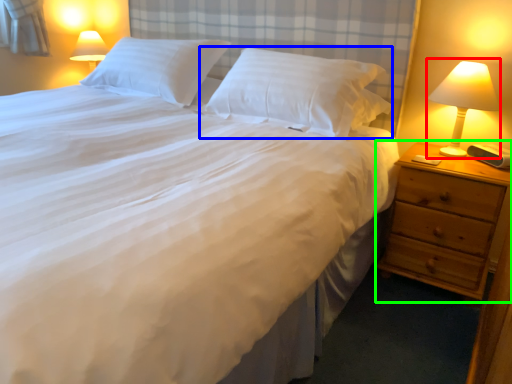
Question: Considering the real-world distances, which object is closest to bedside lamp (highlighted by a red box)? pillow (highlighted by a blue box) or nightstand (highlighted by a green box).

Choices:
 (A) pillow
 (B) nightstand

Answer: (B)